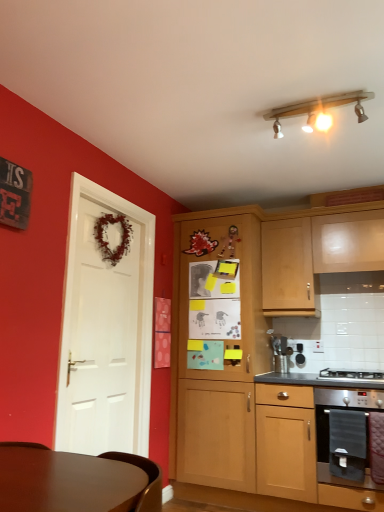
I want to click on light wood cabinet at upper right, which is the first cabinetry from right to left, so click(x=317, y=253).

This screenshot has width=384, height=512. What do you see at coordinates (329, 426) in the screenshot?
I see `stainless steel oven at lower right` at bounding box center [329, 426].

The image size is (384, 512). Describe the element at coordinates (309, 439) in the screenshot. I see `stainless steel oven at lower right, arranged as the second cabinetry when viewed from the right` at that location.

At what (x,y) coordinates should I click in order to perform the action: click on light wood cabinet at upper right, arranged as the third cabinetry when viewed from the left. Please return your answer as a coordinate pair (x, y). This screenshot has height=512, width=384. Looking at the image, I should click on (317, 253).

Is wooden track light at upper center surrounding wooden cabinet at center, the 1th cabinetry viewed from the left?

Actually, wooden cabinet at center, the 1th cabinetry viewed from the left, is outside wooden track light at upper center.

Considering the relative positions of wooden track light at upper center and wooden cabinet at center, the 1th cabinetry viewed from the left, in the image provided, is wooden track light at upper center in front of wooden cabinet at center, the 1th cabinetry viewed from the left,?

Yes, wooden track light at upper center is closer to the camera.

Which of these two, wooden track light at upper center or wooden cabinet at center, the 1th cabinetry viewed from the left, is wider?

With larger width is wooden cabinet at center, the 1th cabinetry viewed from the left.

Is wooden track light at upper center far from wooden cabinet at center, the 1th cabinetry viewed from the left?

That's right, there is a large distance between wooden track light at upper center and wooden cabinet at center, the 1th cabinetry viewed from the left.

Locate an element on the screen. The image size is (384, 512). kitchen appliance that is under the stainless steel gas stove at lower right (from a real-world perspective) is located at coordinates (329, 426).

In terms of size, does stainless steel gas stove at lower right appear bigger or smaller than stainless steel oven at lower right?

In the image, stainless steel gas stove at lower right appears to be smaller than stainless steel oven at lower right.

From the picture: Is stainless steel gas stove at lower right next to stainless steel oven at lower right?

They are not placed beside each other.

Which of these two, stainless steel oven at lower right, which is the second cabinetry in left-to-right order, or wooden track light at upper center, stands taller?

With more height is stainless steel oven at lower right, which is the second cabinetry in left-to-right order.

Which object is thinner, stainless steel oven at lower right, which is the second cabinetry in left-to-right order, or wooden track light at upper center?

With smaller width is wooden track light at upper center.

From the image's perspective, is stainless steel oven at lower right located beneath wooden cabinet at center, the 1th cabinetry viewed from the left?

Indeed, from the image's perspective, stainless steel oven at lower right is shown beneath wooden cabinet at center, the 1th cabinetry viewed from the left.

Based on the photo, is stainless steel oven at lower right facing away from wooden cabinet at center, the 1th cabinetry viewed from the left?

No, stainless steel oven at lower right is not facing the opposite direction of wooden cabinet at center, the 1th cabinetry viewed from the left.

Is stainless steel oven at lower right smaller than wooden cabinet at center, the 1th cabinetry viewed from the left?

Yes.

From a real-world perspective, is stainless steel oven at lower right positioned over wooden cabinet at center, the third cabinetry positioned from the right, based on gravity?

Actually, stainless steel oven at lower right is physically below wooden cabinet at center, the third cabinetry positioned from the right, in the real world.

Is light wood cabinet at upper right, arranged as the third cabinetry when viewed from the left, to the left of white matte door at left from the viewer's perspective?

Incorrect, light wood cabinet at upper right, arranged as the third cabinetry when viewed from the left, is not on the left side of white matte door at left.

Is light wood cabinet at upper right, which is the first cabinetry from right to left, looking in the opposite direction of white matte door at left?

light wood cabinet at upper right, which is the first cabinetry from right to left, does not have its back to white matte door at left.

Are light wood cabinet at upper right, arranged as the third cabinetry when viewed from the left, and white matte door at left located far from each other?

Indeed, light wood cabinet at upper right, arranged as the third cabinetry when viewed from the left, is not near white matte door at left.

From a real-world perspective, who is located lower, light wood cabinet at upper right, which is the first cabinetry from right to left, or white matte door at left?

white matte door at left is physically lower.

Could you tell me if wooden track light at upper center is facing light wood cabinet at upper right, which is the first cabinetry from right to left?

No, wooden track light at upper center is not aimed at light wood cabinet at upper right, which is the first cabinetry from right to left.

Find the location of `lamp above the light wood cabinet at upper right, arranged as the third cabinetry when viewed from the left (from a real-world perspective)`. lamp above the light wood cabinet at upper right, arranged as the third cabinetry when viewed from the left (from a real-world perspective) is located at coordinates (318, 111).

Between wooden track light at upper center and light wood cabinet at upper right, which is the first cabinetry from right to left, which one has larger size?

light wood cabinet at upper right, which is the first cabinetry from right to left, is bigger.

From a real-world perspective, is white matte door at left positioned above or below wooden cabinet at center, the third cabinetry positioned from the right?

white matte door at left is situated higher than wooden cabinet at center, the third cabinetry positioned from the right, in the real world.

There is a white matte door at left. At what (x,y) coordinates should I click in order to perform the action: click on the 1st cabinetry below it (from the image's perspective). Please return your answer as a coordinate pair (x, y). The height and width of the screenshot is (512, 384). Looking at the image, I should click on 217,350.

Looking at the image, does white matte door at left seem bigger or smaller compared to wooden cabinet at center, the third cabinetry positioned from the right?

Clearly, white matte door at left is smaller in size than wooden cabinet at center, the third cabinetry positioned from the right.

Would you say white matte door at left is a long distance from wooden cabinet at center, the 1th cabinetry viewed from the left?

No.

From the image's perspective, which cabinetry is the 2nd one below the wooden track light at upper center? Please provide its 2D coordinates.

[(217, 350)]

Where is `gas stove above the stainless steel oven at lower right (from a real-world perspective)`? gas stove above the stainless steel oven at lower right (from a real-world perspective) is located at coordinates tap(351, 375).

Based on their spatial positions, is wooden track light at upper center or light wood cabinet at upper right, which is the first cabinetry from right to left, further from stainless steel gas stove at lower right?

wooden track light at upper center is positioned further to the anchor stainless steel gas stove at lower right.

From the image, which object appears to be farther from white matte door at left, wooden cabinet at center, the 1th cabinetry viewed from the left, or light wood cabinet at upper right, which is the first cabinetry from right to left?

Among the two, light wood cabinet at upper right, which is the first cabinetry from right to left, is located further to white matte door at left.

Estimate the real-world distances between objects in this image. Which object is further from wooden track light at upper center, wooden cabinet at center, the 1th cabinetry viewed from the left, or stainless steel oven at lower right?

Among the two, stainless steel oven at lower right is located further to wooden track light at upper center.

Considering their positions, is wooden cabinet at center, the 1th cabinetry viewed from the left, positioned further to stainless steel oven at lower right than stainless steel gas stove at lower right?

The object further to stainless steel oven at lower right is wooden cabinet at center, the 1th cabinetry viewed from the left.

Which object lies further to the anchor point stainless steel oven at lower right, which is the second cabinetry in left-to-right order, wooden cabinet at center, the third cabinetry positioned from the right, or white matte door at left?

white matte door at left.

Which object lies further to the anchor point white matte door at left, wooden cabinet at center, the 1th cabinetry viewed from the left, or wooden track light at upper center?

The object further to white matte door at left is wooden track light at upper center.

Considering their positions, is light wood cabinet at upper right, arranged as the third cabinetry when viewed from the left, positioned closer to stainless steel oven at lower right than stainless steel gas stove at lower right?

Among the two, stainless steel gas stove at lower right is located nearer to stainless steel oven at lower right.

Looking at the image, which one is located further to stainless steel oven at lower right, which is the second cabinetry in left-to-right order, wooden cabinet at center, the third cabinetry positioned from the right, or stainless steel gas stove at lower right?

wooden cabinet at center, the third cabinetry positioned from the right, lies further to stainless steel oven at lower right, which is the second cabinetry in left-to-right order, than the other object.

You are a GUI agent. You are given a task and a screenshot of the screen. Output one action in this format:
    pyautogui.click(x=<x>, y=<y>)
    Task: Click on the cabinetry located between white matte door at left and stainless steel oven at lower right, arranged as the second cabinetry when viewed from the right, in the left-right direction
    The image size is (384, 512).
    Given the screenshot: What is the action you would take?
    pyautogui.click(x=217, y=350)

Image resolution: width=384 pixels, height=512 pixels. I want to click on kitchen appliance located between white matte door at left and stainless steel gas stove at lower right in the left-right direction, so click(329, 426).

At what (x,y) coordinates should I click in order to perform the action: click on cabinetry between light wood cabinet at upper right, which is the first cabinetry from right to left, and stainless steel oven at lower right, which is the second cabinetry in left-to-right order, in the vertical direction. Please return your answer as a coordinate pair (x, y). The width and height of the screenshot is (384, 512). Looking at the image, I should click on (217, 350).

You are a GUI agent. You are given a task and a screenshot of the screen. Output one action in this format:
    pyautogui.click(x=<x>, y=<y>)
    Task: Click on the gas stove that lies between light wood cabinet at upper right, which is the first cabinetry from right to left, and stainless steel oven at lower right, arranged as the second cabinetry when viewed from the right, from top to bottom
    This screenshot has height=512, width=384.
    Given the screenshot: What is the action you would take?
    pyautogui.click(x=351, y=375)